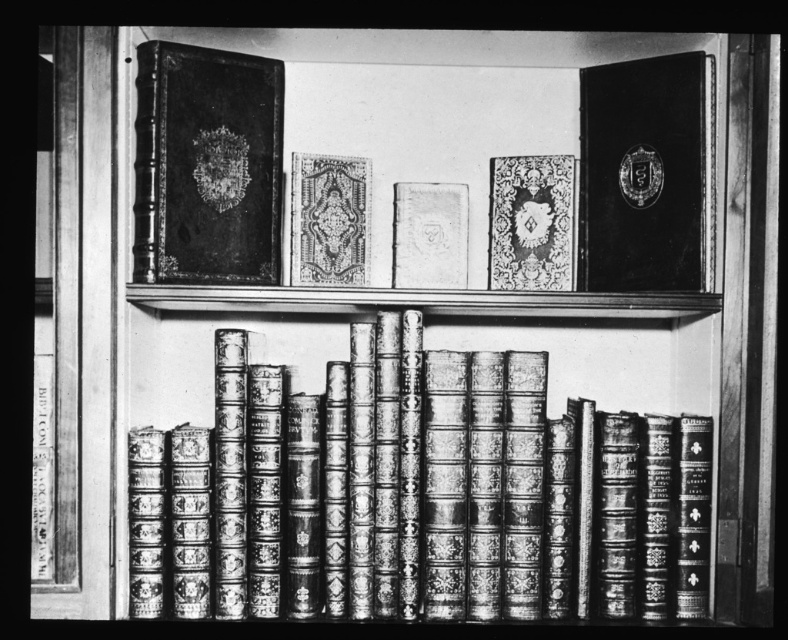
Where is `matte black book at upper left`? The image size is (788, 640). matte black book at upper left is located at coordinates (206, 164).

Consider the image. Is matte black book at upper left behind matte gold-patterned book at center?

No, matte black book at upper left is in front of matte gold-patterned book at center.

Find the location of a particular element. This screenshot has width=788, height=640. matte black book at upper left is located at coordinates (206, 164).

Which of these two, leather-bound books at center or matte gold-patterned book at center, stands shorter?

matte gold-patterned book at center is shorter.

Between leather-bound books at center and matte gold-patterned book at center, which one appears on the left side from the viewer's perspective?

Positioned to the left is matte gold-patterned book at center.

The image size is (788, 640). In order to click on leather-bound books at center in this screenshot , I will do `click(417, 493)`.

Who is positioned more to the right, shiny black book at upper right or decorative leather book at center?

shiny black book at upper right

Can you confirm if shiny black book at upper right is thinner than decorative leather book at center?

No, shiny black book at upper right is not thinner than decorative leather book at center.

Locate an element on the screen. This screenshot has height=640, width=788. shiny black book at upper right is located at coordinates (647, 173).

Identify the location of shiny black book at upper right. This screenshot has width=788, height=640. (647, 173).